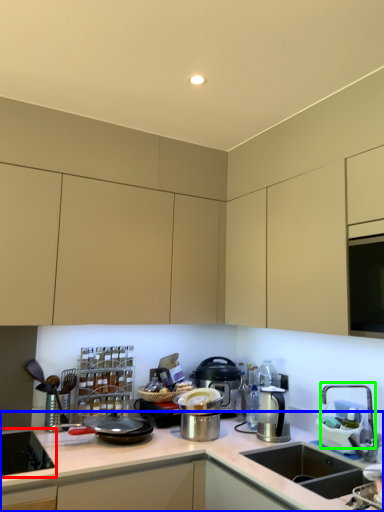
Question: Considering the real-world distances, which object is farthest from home appliance (highlighted by a red box)? countertop (highlighted by a blue box) or faucet (highlighted by a green box)?

Choices:
 (A) countertop
 (B) faucet

Answer: (B)